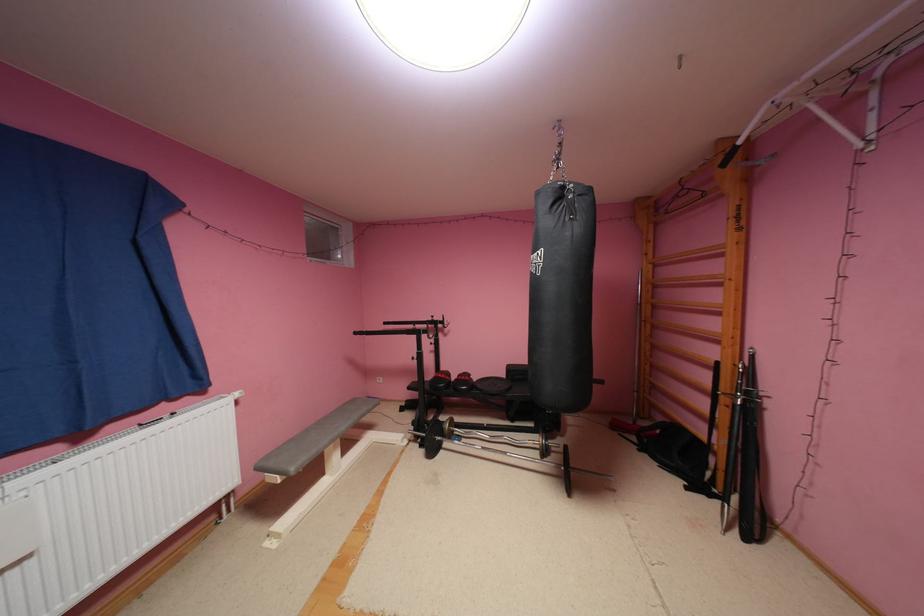
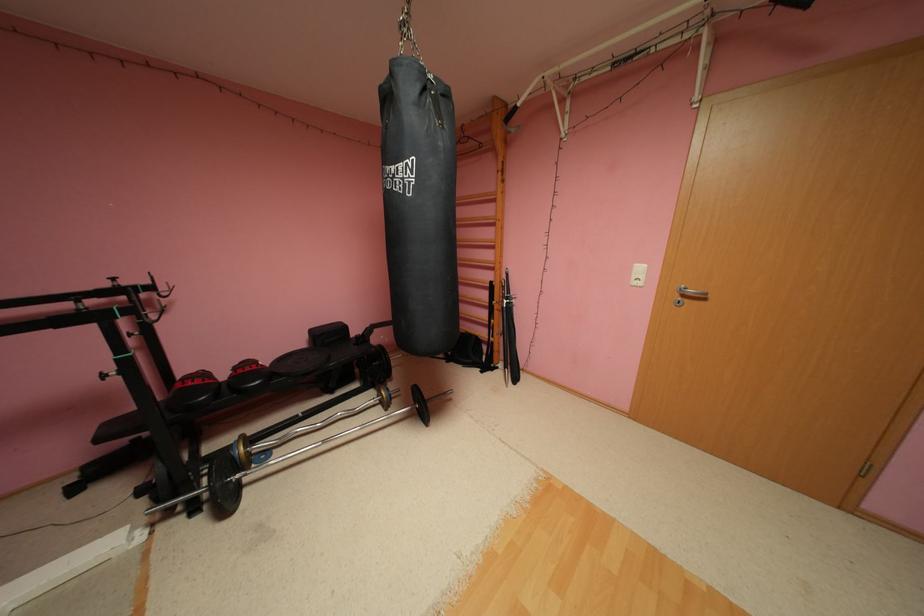
Question: How did the camera likely rotate?

Choices:
 (A) Left
 (B) Right
 (C) Up
 (D) Down

Answer: (B)